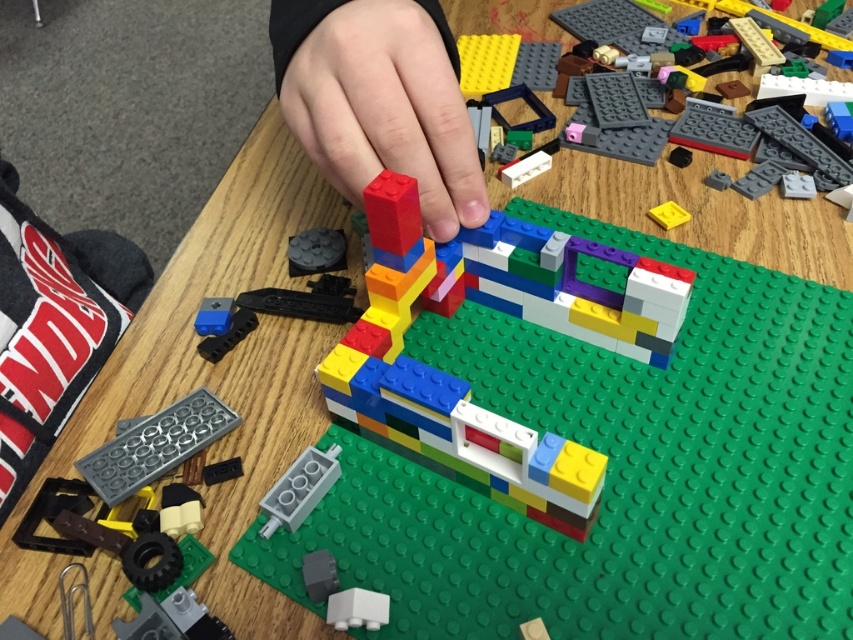
Is matte plastic hand at center to the left of translucent plastic brick at center from the viewer's perspective?

Yes, matte plastic hand at center is to the left of translucent plastic brick at center.

Is matte plastic hand at center shorter than translucent plastic brick at center?

Indeed, matte plastic hand at center has a lesser height compared to translucent plastic brick at center.

Between point (427, 113) and point (750, 92), which one is positioned behind?

Positioned behind is point (750, 92).

Locate an element on the screen. This screenshot has height=640, width=853. matte plastic hand at center is located at coordinates (380, 100).